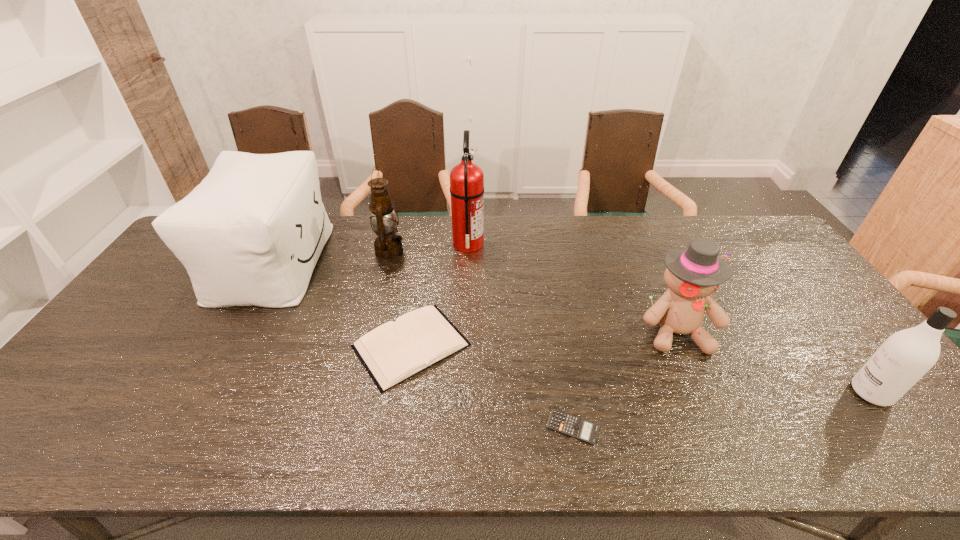
This screenshot has width=960, height=540. I want to click on vacant area that lies between the rag_doll and the hardback book, so click(543, 338).

You are a GUI agent. You are given a task and a screenshot of the screen. Output one action in this format:
    pyautogui.click(x=<x>, y=<y>)
    Task: Click on the free space between the rag_doll and the sixth tallest object
    
    Given the screenshot: What is the action you would take?
    pyautogui.click(x=543, y=338)

This screenshot has height=540, width=960. I want to click on free point between the fifth object from left to right and the rag_doll, so click(624, 379).

Identify the location of free spot between the second shortest object and the rightmost object. (x=641, y=369).

Point out which object is positioned as the third nearest to the cushion. Please provide its 2D coordinates. Your answer should be formatted as a tuple, i.e. [(x, y)], where the tuple contains the x and y coordinates of a point satisfying the conditions above.

[(466, 179)]

Locate an element on the screen. Image resolution: width=960 pixels, height=540 pixels. object that ranks as the closest to the oil lamp is located at coordinates (466, 179).

Where is `free point that satisfies the following two spatial constraints: 1. on the side of the leftmost object with the smiley face; 2. on the back side of the hardback book`? free point that satisfies the following two spatial constraints: 1. on the side of the leftmost object with the smiley face; 2. on the back side of the hardback book is located at coordinates (226, 345).

The image size is (960, 540). In order to click on vacant space that satisfies the following two spatial constraints: 1. at the nozzle of the fire extinguisher; 2. on the back side of the nearest object in this screenshot , I will do `click(462, 427)`.

Where is `free region that satisfies the following two spatial constraints: 1. on the side of the calculator with the smiley face; 2. on the left side of the cushion`? The width and height of the screenshot is (960, 540). free region that satisfies the following two spatial constraints: 1. on the side of the calculator with the smiley face; 2. on the left side of the cushion is located at coordinates (180, 427).

Locate an element on the screen. The height and width of the screenshot is (540, 960). vacant space that satisfies the following two spatial constraints: 1. at the nozzle of the fire extinguisher; 2. on the left side of the third object from right to left is located at coordinates (462, 427).